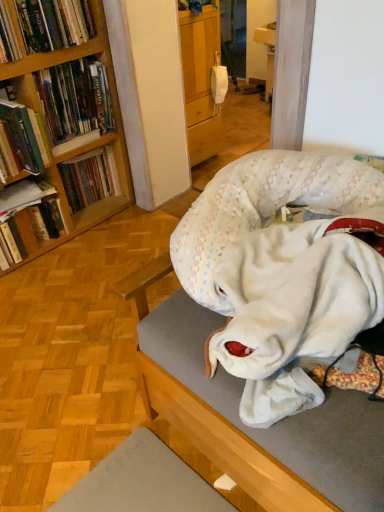
Question: Should I look upward or downward to see white plush dog bed at center?

Choices:
 (A) down
 (B) up

Answer: (A)

Question: Considering the relative sizes of hardcover book at upper left, placed as the 1th book when sorted from top to bottom, and white plush dog bed at center in the image provided, is hardcover book at upper left, placed as the 1th book when sorted from top to bottom, smaller than white plush dog bed at center?

Choices:
 (A) yes
 (B) no

Answer: (A)

Question: Is hardcover book at upper left, acting as the 6th book starting from the bottom, to the left of white plush dog bed at center from the viewer's perspective?

Choices:
 (A) no
 (B) yes

Answer: (B)

Question: Considering the relative sizes of hardcover book at upper left, acting as the 6th book starting from the bottom, and white plush dog bed at center in the image provided, is hardcover book at upper left, acting as the 6th book starting from the bottom, wider than white plush dog bed at center?

Choices:
 (A) yes
 (B) no

Answer: (B)

Question: Is the position of hardcover book at upper left, placed as the 1th book when sorted from top to bottom, more distant than that of white plush dog bed at center?

Choices:
 (A) yes
 (B) no

Answer: (A)

Question: Can you confirm if hardcover book at upper left, acting as the 6th book starting from the bottom, is taller than white plush dog bed at center?

Choices:
 (A) yes
 (B) no

Answer: (B)

Question: Considering the relative positions of hardcover book at upper left, acting as the 6th book starting from the bottom, and white plush dog bed at center in the image provided, is hardcover book at upper left, acting as the 6th book starting from the bottom, to the right of white plush dog bed at center from the viewer's perspective?

Choices:
 (A) yes
 (B) no

Answer: (B)

Question: From the image's perspective, is hardcover books at left, acting as the fifth book starting from the bottom, located beneath hardcover book at left, the 6th book positioned from the top?

Choices:
 (A) no
 (B) yes

Answer: (A)

Question: Does hardcover books at left, acting as the fifth book starting from the bottom, have a smaller size compared to hardcover book at left, the 6th book positioned from the top?

Choices:
 (A) no
 (B) yes

Answer: (A)

Question: Is hardcover books at left, the second book when ordered from top to bottom, positioned with its back to hardcover book at left, the 6th book positioned from the top?

Choices:
 (A) yes
 (B) no

Answer: (B)

Question: Can you confirm if hardcover books at left, the second book when ordered from top to bottom, is bigger than hardcover book at left, which ranks as the 1th book in bottom-to-top order?

Choices:
 (A) yes
 (B) no

Answer: (A)

Question: Is hardcover books at left, acting as the fifth book starting from the bottom, not close to hardcover book at left, the 6th book positioned from the top?

Choices:
 (A) no
 (B) yes

Answer: (A)

Question: Considering the relative sizes of hardcover books at left, the second book when ordered from top to bottom, and hardcover book at left, which ranks as the 1th book in bottom-to-top order, in the image provided, is hardcover books at left, the second book when ordered from top to bottom, wider than hardcover book at left, which ranks as the 1th book in bottom-to-top order,?

Choices:
 (A) yes
 (B) no

Answer: (B)

Question: Could hardcover book at left, which is counted as the 4th book, starting from the bottom, be considered to be inside hardcover book at left, which is counted as the third book, starting from the bottom?

Choices:
 (A) no
 (B) yes

Answer: (A)